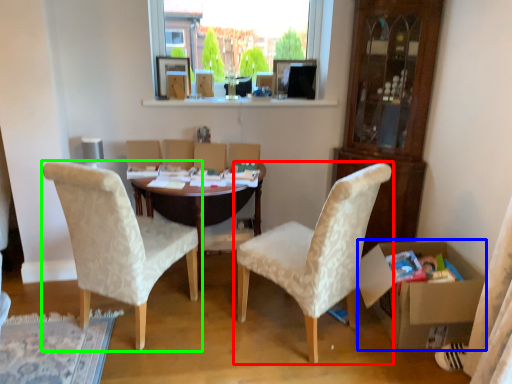
Question: Which is nearer to the chair (highlighted by a red box)? box (highlighted by a blue box) or chair (highlighted by a green box).

Choices:
 (A) box
 (B) chair

Answer: (A)